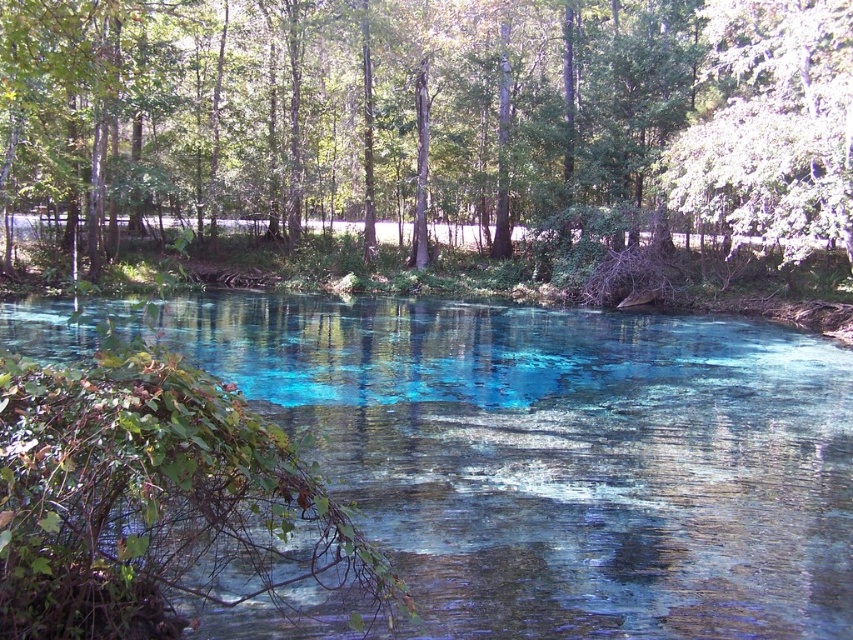
Which is below, green leafy tree at center or white textured tree at upper right?

white textured tree at upper right is below.

Does green leafy tree at center appear under white textured tree at upper right?

Incorrect, green leafy tree at center is not positioned below white textured tree at upper right.

At what (x,y) coordinates should I click in order to perform the action: click on green leafy tree at center. Please return your answer as a coordinate pair (x, y). Looking at the image, I should click on (431, 112).

Can you confirm if translucent blue water at center is thinner than green leafy tree at center?

Yes.

Is translucent blue water at center smaller than green leafy tree at center?

Yes, translucent blue water at center is smaller than green leafy tree at center.

Does point (78, 348) lie in front of point (500, 17)?

Yes, point (78, 348) is closer to viewer.

The image size is (853, 640). Find the location of `translucent blue water at center`. translucent blue water at center is located at coordinates (563, 458).

Measure the distance between translucent blue water at center and white textured tree at upper right.

translucent blue water at center and white textured tree at upper right are 10.63 meters apart.

What do you see at coordinates (563, 458) in the screenshot?
I see `translucent blue water at center` at bounding box center [563, 458].

What do you see at coordinates (563, 458) in the screenshot?
I see `translucent blue water at center` at bounding box center [563, 458].

Where is `translucent blue water at center`? This screenshot has width=853, height=640. translucent blue water at center is located at coordinates (563, 458).